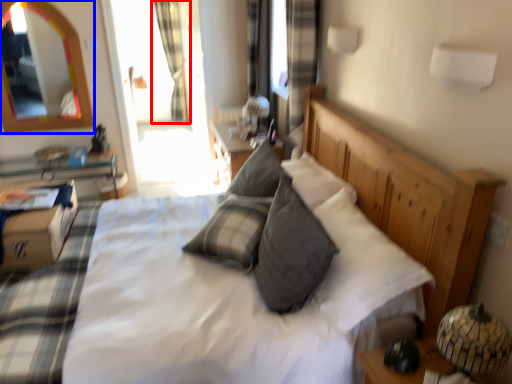
Question: Which object is further to the camera taking this photo, curtain (highlighted by a red box) or mirror (highlighted by a blue box)?

Choices:
 (A) curtain
 (B) mirror

Answer: (A)